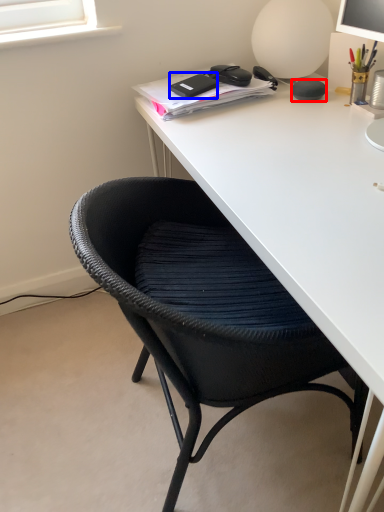
Question: Which object is closer to the camera taking this photo, stationery (highlighted by a red box) or stationery (highlighted by a blue box)?

Choices:
 (A) stationery
 (B) stationery

Answer: (A)